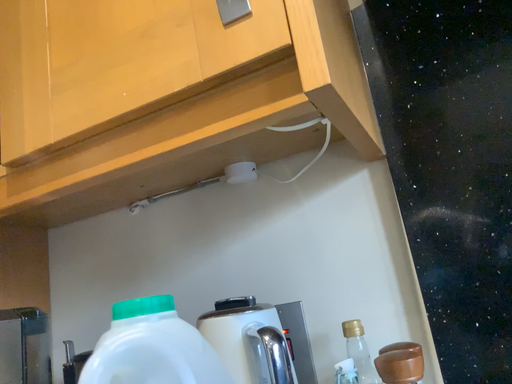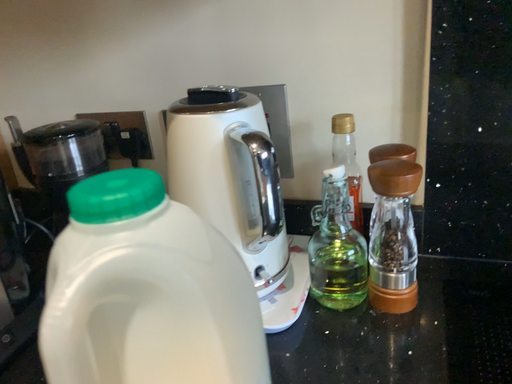
Question: Which way did the camera rotate in the video?

Choices:
 (A) rotated upward
 (B) rotated downward

Answer: (B)